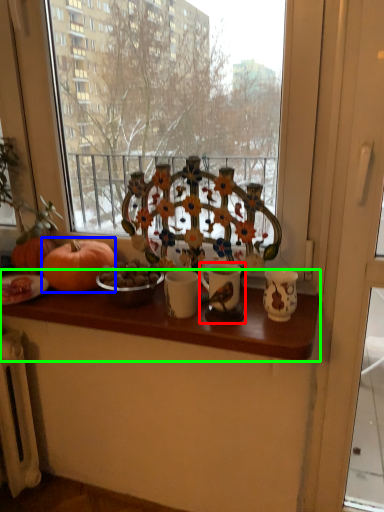
Question: Considering the real-world distances, which object is closest to candle holder (highlighted by a red box)? pumpkin (highlighted by a blue box) or table (highlighted by a green box).

Choices:
 (A) pumpkin
 (B) table

Answer: (B)